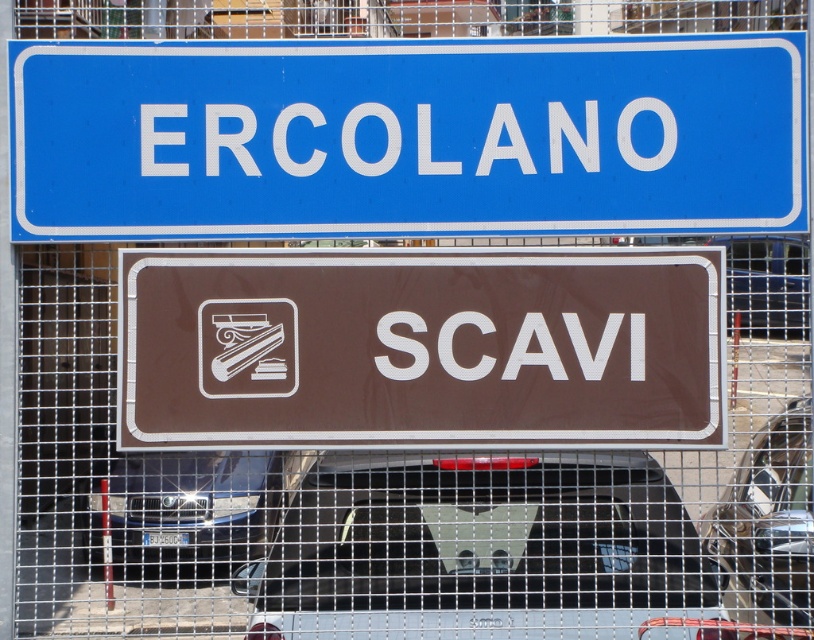
In the scene shown: You are a delivery driver who needs to park your black matte car at lower center in a spot that is not obstructed by the road signs or the fence. Based on the coordinates provided, can you determine if the car can be parked safely without overlapping with the road signs or the fence?

The black matte car at lower center is located at coordinates point (480, 548), which is outside the area occupied by the road signs and the fence. Therefore, it can be parked safely without overlapping with them.

You are a delivery driver needing to park your car, which is 5 meters long, between the black matte car at lower center and the black metallic car at center. Is there enough space for your car?

The distance between the black matte car at lower center and the black metallic car at center is 6.31 meters. Since your car is 5 meters long, there is sufficient space to park between them.

You are standing in front of a fence with road signs. You want to take a photo of the brown plastic sign at center without including the parked cars behind it. Since the sign is 4.46 meters away from you, how far back should you step to ensure the cars are out of frame?

To avoid capturing the parked cars behind the brown plastic sign at center, you should step back further than 4.46 meters away from the sign. This distance ensures the cars, which are behind the sign, are no longer in the camera frame.